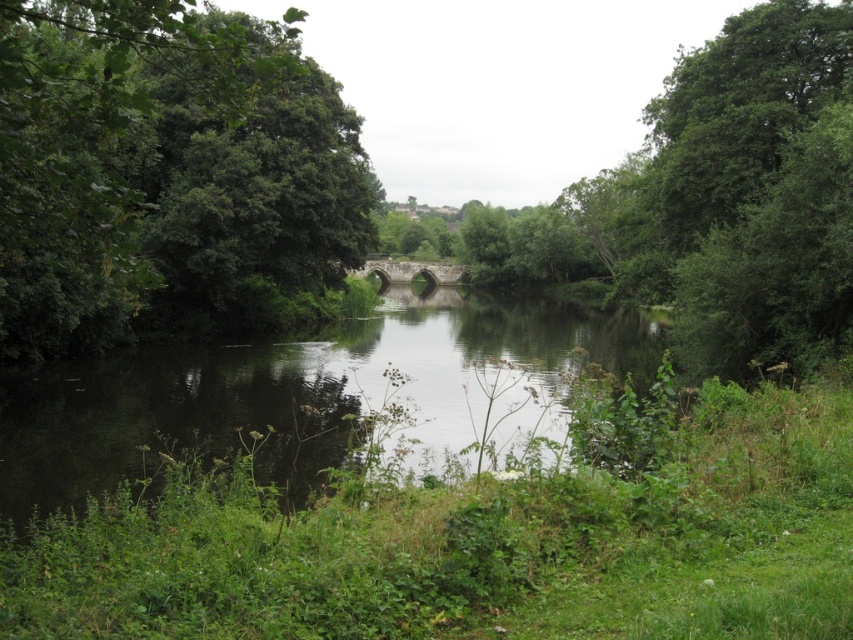
Is point (0, 240) farther from camera compared to point (230, 417)?

No, (0, 240) is closer to viewer.

Is green leafy tree at left closer to the viewer compared to dark reflective water at center?

Yes, green leafy tree at left is in front of dark reflective water at center.

Who is more forward, (134, 80) or (332, 390)?

Point (332, 390) is more forward.

At what (x,y) coordinates should I click in order to perform the action: click on green leafy tree at left. Please return your answer as a coordinate pair (x, y). The height and width of the screenshot is (640, 853). Looking at the image, I should click on (167, 176).